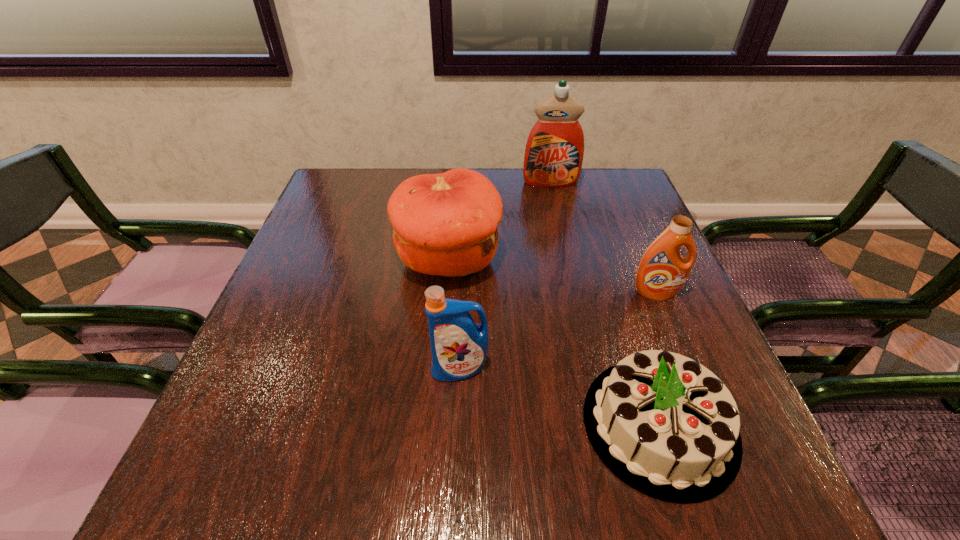
Where is `the tallest detergent`? This screenshot has width=960, height=540. the tallest detergent is located at coordinates (554, 151).

This screenshot has height=540, width=960. Identify the location of the farthest detergent. (554, 151).

The height and width of the screenshot is (540, 960). In order to click on pumpkin in this screenshot , I will do (x=445, y=224).

Locate an element on the screen. The width and height of the screenshot is (960, 540). the rightmost detergent is located at coordinates (662, 272).

Identify the location of the nearest detergent. The image size is (960, 540). (459, 346).

Locate an element on the screen. This screenshot has width=960, height=540. birthday cake is located at coordinates (668, 427).

Identify the location of vacant space located 0.160m on the front surface of the tallest detergent. The height and width of the screenshot is (540, 960). point(560,221).

Locate an element on the screen. This screenshot has height=540, width=960. free space located 0.060m on the front of the pumpkin is located at coordinates (444, 318).

Locate an element on the screen. vacant area located 0.370m on the front-facing side of the rightmost detergent is located at coordinates click(729, 469).

The height and width of the screenshot is (540, 960). Identify the location of free space located 0.100m on the label of the nearest detergent. (457, 434).